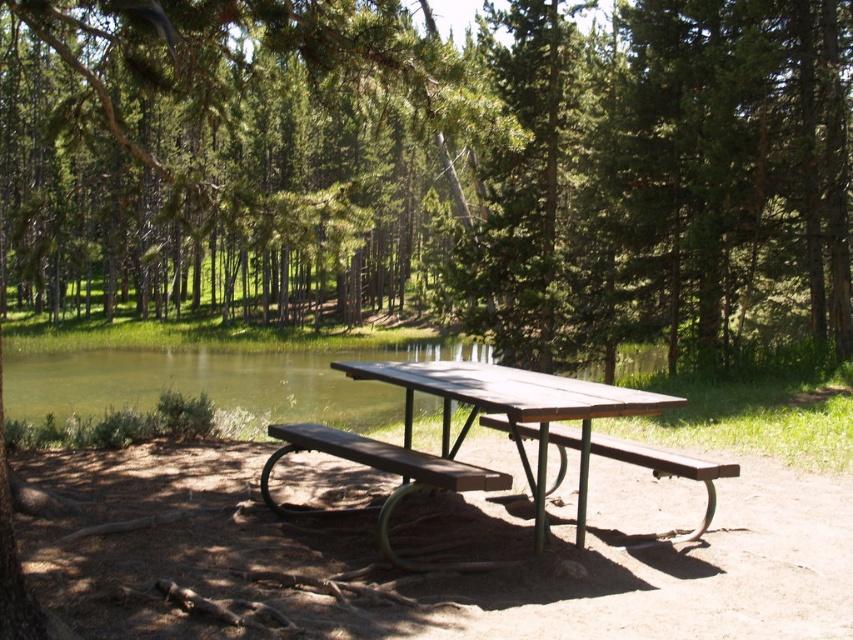
Does point (126, 100) come behind point (509, 372)?

Yes, it is.

Between green textured tree at center and wooden picnic table at center, which one is positioned higher?

green textured tree at center is above.

At what (x,y) coordinates should I click in order to perform the action: click on green textured tree at center. Please return your answer as a coordinate pair (x, y). This screenshot has width=853, height=640. Looking at the image, I should click on (438, 164).

Find the location of a particular element. Image resolution: width=853 pixels, height=640 pixels. green textured tree at center is located at coordinates (438, 164).

Between wooden bench at center and brown wooden bench at center, which one has less height?

wooden bench at center is shorter.

Which is above, wooden bench at center or brown wooden bench at center?

brown wooden bench at center is above.

Where is `wooden bench at center`? Image resolution: width=853 pixels, height=640 pixels. wooden bench at center is located at coordinates (384, 472).

The height and width of the screenshot is (640, 853). Find the location of `wooden bench at center`. wooden bench at center is located at coordinates (384, 472).

The image size is (853, 640). Describe the element at coordinates (438, 164) in the screenshot. I see `green textured tree at center` at that location.

Locate an element on the screen. green textured tree at center is located at coordinates (438, 164).

Identify the location of green textured tree at center. The height and width of the screenshot is (640, 853). (438, 164).